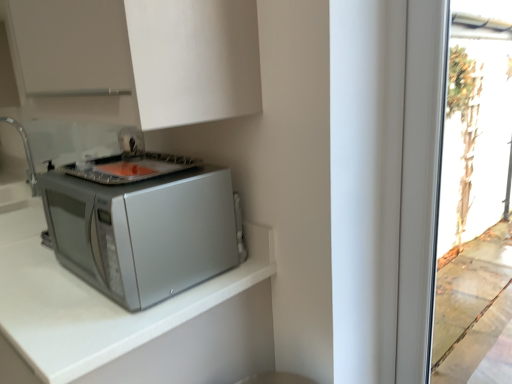
Describe the element at coordinates (136, 60) in the screenshot. I see `white matte cabinet at upper center` at that location.

What do you see at coordinates (131, 318) in the screenshot? I see `silver matte microwave at lower left` at bounding box center [131, 318].

The width and height of the screenshot is (512, 384). Identify the location of brushed metal sink at left. (25, 154).

What's the angular difference between brushed metal sink at left and silver matte microwave at lower left's facing directions?

The facing directions of brushed metal sink at left and silver matte microwave at lower left are 2.93 degrees apart.

Between brushed metal sink at left and silver matte microwave at lower left, which one is positioned behind?

Positioned behind is brushed metal sink at left.

From a real-world perspective, is brushed metal sink at left on top of silver matte microwave at lower left?

Correct, in the physical world, brushed metal sink at left is higher than silver matte microwave at lower left.

Between brushed metal sink at left and silver matte microwave at lower left, which one appears on the right side from the viewer's perspective?

silver matte microwave at lower left is more to the right.

Which object is positioned more to the left, white matte cabinet at upper center or silver matte microwave at lower left?

From the viewer's perspective, silver matte microwave at lower left appears more on the left side.

Considering the relative sizes of white matte cabinet at upper center and silver matte microwave at lower left in the image provided, is white matte cabinet at upper center taller than silver matte microwave at lower left?

No.

This screenshot has height=384, width=512. What are the coordinates of `sink that is behind the satin silver microwave at lower left` in the screenshot? It's located at (25, 154).

Who is bigger, satin silver microwave at lower left or brushed metal sink at left?

Bigger between the two is satin silver microwave at lower left.

Considering the relative sizes of satin silver microwave at lower left and brushed metal sink at left in the image provided, is satin silver microwave at lower left thinner than brushed metal sink at left?

In fact, satin silver microwave at lower left might be wider than brushed metal sink at left.

Considering the relative positions of satin silver microwave at lower left and white matte cabinet at upper center in the image provided, is satin silver microwave at lower left to the left or to the right of white matte cabinet at upper center?

Based on their positions, satin silver microwave at lower left is located to the right of white matte cabinet at upper center.

Measure the distance between satin silver microwave at lower left and white matte cabinet at upper center.

satin silver microwave at lower left is 11.12 inches away from white matte cabinet at upper center.

Between satin silver microwave at lower left and white matte cabinet at upper center, which one has less height?

satin silver microwave at lower left.

Can you tell me how much satin silver microwave at lower left and white matte cabinet at upper center differ in facing direction?

There is a 1.55-degree angle between the facing directions of satin silver microwave at lower left and white matte cabinet at upper center.

Is silver matte microwave at lower left taller or shorter than white matte cabinet at upper center?

Clearly, silver matte microwave at lower left is taller compared to white matte cabinet at upper center.

Is silver matte microwave at lower left thinner than white matte cabinet at upper center?

No.

Is point (265, 330) less distant than point (183, 125)?

No, (265, 330) is further to viewer.

Who is more distant, silver matte microwave at lower left or white matte cabinet at upper center?

silver matte microwave at lower left.

Find the location of a particular element. cabinetry lying on the right of brushed metal sink at left is located at coordinates (136, 60).

Considering the relative sizes of white matte cabinet at upper center and brushed metal sink at left in the image provided, is white matte cabinet at upper center taller than brushed metal sink at left?

Yes.

Is white matte cabinet at upper center surrounding brushed metal sink at left?

Definitely not — brushed metal sink at left is not inside white matte cabinet at upper center.

From a real-world perspective, who is located higher, white matte cabinet at upper center or brushed metal sink at left?

In real-world perspective, white matte cabinet at upper center is above.

In the scene shown: Does brushed metal sink at left appear on the left side of white matte cabinet at upper center?

Indeed, brushed metal sink at left is positioned on the left side of white matte cabinet at upper center.

Is brushed metal sink at left with white matte cabinet at upper center?

No, brushed metal sink at left is not with white matte cabinet at upper center.

Which of these two, brushed metal sink at left or white matte cabinet at upper center, is wider?

Wider between the two is white matte cabinet at upper center.

Is brushed metal sink at left positioned in front of white matte cabinet at upper center?

No.

There is a silver matte microwave at lower left. Where is `sink above it (from a real-world perspective)`? This screenshot has height=384, width=512. sink above it (from a real-world perspective) is located at coordinates (25, 154).

The height and width of the screenshot is (384, 512). Find the location of `countertop located behind the white matte cabinet at upper center`. countertop located behind the white matte cabinet at upper center is located at coordinates (131, 318).

Considering their positions, is white matte cabinet at upper center positioned closer to satin silver microwave at lower left than brushed metal sink at left?

white matte cabinet at upper center.

Which object lies further to the anchor point brushed metal sink at left, white matte cabinet at upper center or silver matte microwave at lower left?

The object further to brushed metal sink at left is white matte cabinet at upper center.

From the image, which object appears to be nearer to brushed metal sink at left, satin silver microwave at lower left or silver matte microwave at lower left?

Among the two, satin silver microwave at lower left is located nearer to brushed metal sink at left.

Based on their spatial positions, is brushed metal sink at left or white matte cabinet at upper center closer to satin silver microwave at lower left?

Based on the image, white matte cabinet at upper center appears to be nearer to satin silver microwave at lower left.

Based on their spatial positions, is silver matte microwave at lower left or white matte cabinet at upper center closer to brushed metal sink at left?

Among the two, silver matte microwave at lower left is located nearer to brushed metal sink at left.

Based on their spatial positions, is silver matte microwave at lower left or white matte cabinet at upper center closer to satin silver microwave at lower left?

Based on the image, silver matte microwave at lower left appears to be nearer to satin silver microwave at lower left.

Which object lies nearer to the anchor point brushed metal sink at left, satin silver microwave at lower left or white matte cabinet at upper center?

satin silver microwave at lower left.

When comparing their distances from white matte cabinet at upper center, does silver matte microwave at lower left or brushed metal sink at left seem closer?

silver matte microwave at lower left lies closer to white matte cabinet at upper center than the other object.

At what (x,y) coordinates should I click in order to perform the action: click on home appliance between white matte cabinet at upper center and brushed metal sink at left along the z-axis. Please return your answer as a coordinate pair (x, y). Image resolution: width=512 pixels, height=384 pixels. Looking at the image, I should click on (143, 232).

At what (x,y) coordinates should I click in order to perform the action: click on home appliance between white matte cabinet at upper center and silver matte microwave at lower left in the vertical direction. Please return your answer as a coordinate pair (x, y). Looking at the image, I should click on (143, 232).

This screenshot has width=512, height=384. In order to click on home appliance between silver matte microwave at lower left and brushed metal sink at left in the front-back direction in this screenshot , I will do `click(143, 232)`.

Image resolution: width=512 pixels, height=384 pixels. I want to click on countertop between white matte cabinet at upper center and brushed metal sink at left in the front-back direction, so click(131, 318).